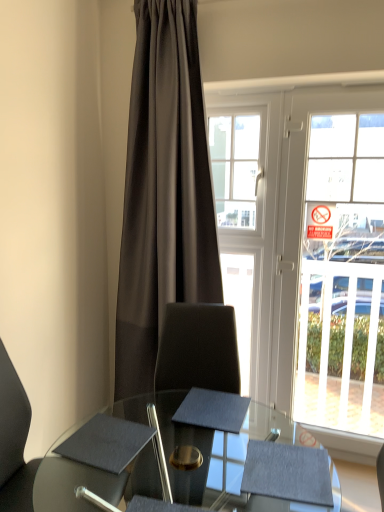
Question: In terms of size, does matte black chair at lower left appear bigger or smaller than matte black notepad at center, marked as the first notepad in a right-to-left arrangement?

Choices:
 (A) small
 (B) big

Answer: (B)

Question: From a real-world perspective, is matte black chair at lower left positioned above or below matte black notepad at center, marked as the first notepad in a right-to-left arrangement?

Choices:
 (A) above
 (B) below

Answer: (B)

Question: Which object is positioned closest to the matte black swivel chair at center?

Choices:
 (A) matte black notepad at center, placed as the 2th notepad when sorted from left to right
 (B) clear glass bay window at center
 (C) matte black chair at lower left
 (D) dark gray fabric curtain at center
 (E) white glass door at right

Answer: (A)

Question: Considering the real-world distances, which object is farthest from the clear glass bay window at center?

Choices:
 (A) matte black notepad at center, marked as the first notepad in a right-to-left arrangement
 (B) matte black chair at lower left
 (C) white glass door at right
 (D) matte black glass table at center
 (E) matte black notepad at lower left, positioned as the first notepad in left-to-right order

Answer: (B)